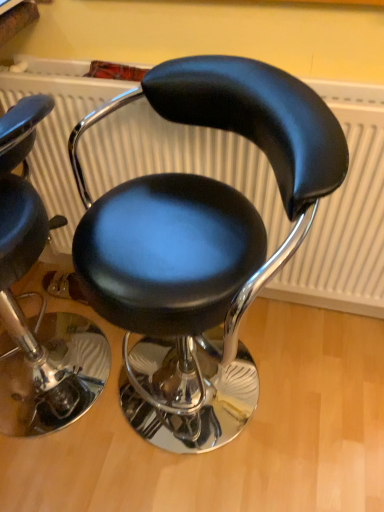
Where is `black leather stool at center, marked as the second chair in a left-to-right arrangement`? The height and width of the screenshot is (512, 384). black leather stool at center, marked as the second chair in a left-to-right arrangement is located at coordinates point(199,233).

Describe the element at coordinates (199, 233) in the screenshot. I see `black leather stool at center, which is counted as the first chair, starting from the right` at that location.

Measure the distance between black leather stool at center, marked as the second chair in a left-to-right arrangement, and camera.

black leather stool at center, marked as the second chair in a left-to-right arrangement, is 23.58 inches from camera.

What is the approximate width of black leather stool at center, marked as the second chair in a left-to-right arrangement?

Result: black leather stool at center, marked as the second chair in a left-to-right arrangement, is 20.42 inches in width.

Measure the distance between point (x=194, y=337) and camera.

Point (x=194, y=337) is 77.10 centimeters from camera.

What do you see at coordinates (43, 303) in the screenshot? The image size is (384, 512). I see `black leather stool at center, positioned as the second chair in right-to-left order` at bounding box center [43, 303].

The image size is (384, 512). I want to click on black leather stool at center, positioned as the second chair in right-to-left order, so click(x=43, y=303).

How much space does black leather stool at center, positioned as the second chair in right-to-left order, occupy horizontally?

It is 18.52 inches.

What is the approximate height of black leather stool at center, positioned as the second chair in right-to-left order?

The height of black leather stool at center, positioned as the second chair in right-to-left order, is 35.14 inches.

Identify the location of black leather stool at center, marked as the second chair in a left-to-right arrangement. This screenshot has height=512, width=384. (199, 233).

Based on the photo, considering the relative positions of black leather stool at center, which is counted as the first chair, starting from the right, and black leather stool at center, acting as the 1th chair starting from the left, in the image provided, is black leather stool at center, which is counted as the first chair, starting from the right, to the right of black leather stool at center, acting as the 1th chair starting from the left, from the viewer's perspective?

Yes, black leather stool at center, which is counted as the first chair, starting from the right, is to the right of black leather stool at center, acting as the 1th chair starting from the left.

Which object is closer to the camera taking this photo, black leather stool at center, marked as the second chair in a left-to-right arrangement, or black leather stool at center, positioned as the second chair in right-to-left order?

black leather stool at center, marked as the second chair in a left-to-right arrangement, is closer to the camera.

Is point (115, 213) behind point (10, 121)?

Yes, point (115, 213) is farther from viewer.

From the image's perspective, who appears lower, black leather stool at center, marked as the second chair in a left-to-right arrangement, or black leather stool at center, positioned as the second chair in right-to-left order?

black leather stool at center, marked as the second chair in a left-to-right arrangement, from the image's perspective.

From a real-world perspective, who is located lower, black leather stool at center, which is counted as the first chair, starting from the right, or black leather stool at center, positioned as the second chair in right-to-left order?

From a 3D spatial view, black leather stool at center, positioned as the second chair in right-to-left order, is below.

In terms of width, does black leather stool at center, marked as the second chair in a left-to-right arrangement, look wider or thinner when compared to black leather stool at center, acting as the 1th chair starting from the left?

Clearly, black leather stool at center, marked as the second chair in a left-to-right arrangement, has more width compared to black leather stool at center, acting as the 1th chair starting from the left.

Can you confirm if black leather stool at center, which is counted as the first chair, starting from the right, is shorter than black leather stool at center, positioned as the second chair in right-to-left order?

No, black leather stool at center, which is counted as the first chair, starting from the right, is not shorter than black leather stool at center, positioned as the second chair in right-to-left order.

Between black leather stool at center, marked as the second chair in a left-to-right arrangement, and black leather stool at center, acting as the 1th chair starting from the left, which one has smaller size?

black leather stool at center, acting as the 1th chair starting from the left.

Looking at this image, is black leather stool at center, which is counted as the first chair, starting from the right, inside the boundaries of black leather stool at center, acting as the 1th chair starting from the left, or outside?

black leather stool at center, which is counted as the first chair, starting from the right, is outside black leather stool at center, acting as the 1th chair starting from the left.

Is black leather stool at center, marked as the second chair in a left-to-right arrangement, directly adjacent to black leather stool at center, acting as the 1th chair starting from the left?

No, black leather stool at center, marked as the second chair in a left-to-right arrangement, is not in contact with black leather stool at center, acting as the 1th chair starting from the left.

Is black leather stool at center, marked as the second chair in a left-to-right arrangement, positioned with its back to black leather stool at center, positioned as the second chair in right-to-left order?

No.

How different are the orientations of black leather stool at center, which is counted as the first chair, starting from the right, and black leather stool at center, acting as the 1th chair starting from the left, in degrees?

The facing directions of black leather stool at center, which is counted as the first chair, starting from the right, and black leather stool at center, acting as the 1th chair starting from the left, are 0.000879 degrees apart.

The image size is (384, 512). I want to click on chair on the left of black leather stool at center, marked as the second chair in a left-to-right arrangement, so click(43, 303).

Can you confirm if black leather stool at center, positioned as the second chair in right-to-left order, is positioned to the right of black leather stool at center, which is counted as the first chair, starting from the right?

Incorrect, black leather stool at center, positioned as the second chair in right-to-left order, is not on the right side of black leather stool at center, which is counted as the first chair, starting from the right.

Is black leather stool at center, positioned as the second chair in right-to-left order, closer to the viewer compared to black leather stool at center, marked as the second chair in a left-to-right arrangement?

No.

Which is in front, point (8, 306) or point (228, 259)?

The point (228, 259) is closer to the camera.

From the image's perspective, which is below, black leather stool at center, positioned as the second chair in right-to-left order, or black leather stool at center, which is counted as the first chair, starting from the right?

From the image's view, black leather stool at center, which is counted as the first chair, starting from the right, is below.

From a real-world perspective, is black leather stool at center, acting as the 1th chair starting from the left, below black leather stool at center, which is counted as the first chair, starting from the right?

Indeed, from a real-world perspective, black leather stool at center, acting as the 1th chair starting from the left, is positioned beneath black leather stool at center, which is counted as the first chair, starting from the right.

In terms of width, does black leather stool at center, positioned as the second chair in right-to-left order, look wider or thinner when compared to black leather stool at center, which is counted as the first chair, starting from the right?

Considering their sizes, black leather stool at center, positioned as the second chair in right-to-left order, looks slimmer than black leather stool at center, which is counted as the first chair, starting from the right.

Is black leather stool at center, acting as the 1th chair starting from the left, taller or shorter than black leather stool at center, marked as the second chair in a left-to-right arrangement?

Clearly, black leather stool at center, acting as the 1th chair starting from the left, is shorter compared to black leather stool at center, marked as the second chair in a left-to-right arrangement.

Is black leather stool at center, positioned as the second chair in right-to-left order, bigger than black leather stool at center, marked as the second chair in a left-to-right arrangement?

No, black leather stool at center, positioned as the second chair in right-to-left order, is not bigger than black leather stool at center, marked as the second chair in a left-to-right arrangement.

Would you say black leather stool at center, positioned as the second chair in right-to-left order, contains black leather stool at center, marked as the second chair in a left-to-right arrangement?

No, black leather stool at center, marked as the second chair in a left-to-right arrangement, is not inside black leather stool at center, positioned as the second chair in right-to-left order.

Is black leather stool at center, acting as the 1th chair starting from the left, in contact with black leather stool at center, which is counted as the first chair, starting from the right?

No, black leather stool at center, acting as the 1th chair starting from the left, is not in contact with black leather stool at center, which is counted as the first chair, starting from the right.

Is black leather stool at center, acting as the 1th chair starting from the left, aimed at black leather stool at center, which is counted as the first chair, starting from the right?

No, black leather stool at center, acting as the 1th chair starting from the left, is not facing towards black leather stool at center, which is counted as the first chair, starting from the right.

What's the angular difference between black leather stool at center, positioned as the second chair in right-to-left order, and black leather stool at center, which is counted as the first chair, starting from the right,'s facing directions?

The angle between the facing direction of black leather stool at center, positioned as the second chair in right-to-left order, and the facing direction of black leather stool at center, which is counted as the first chair, starting from the right, is 0.000879 degrees.

Measure the distance between black leather stool at center, acting as the 1th chair starting from the left, and black leather stool at center, marked as the second chair in a left-to-right arrangement.

The distance of black leather stool at center, acting as the 1th chair starting from the left, from black leather stool at center, marked as the second chair in a left-to-right arrangement, is 52.32 centimeters.

This screenshot has height=512, width=384. Identify the location of chair that is on the left side of black leather stool at center, which is counted as the first chair, starting from the right. (43, 303).

The image size is (384, 512). I want to click on chair that is on the left side of black leather stool at center, which is counted as the first chair, starting from the right, so click(43, 303).

Locate an element on the screen. chair in front of the black leather stool at center, positioned as the second chair in right-to-left order is located at coordinates (199, 233).